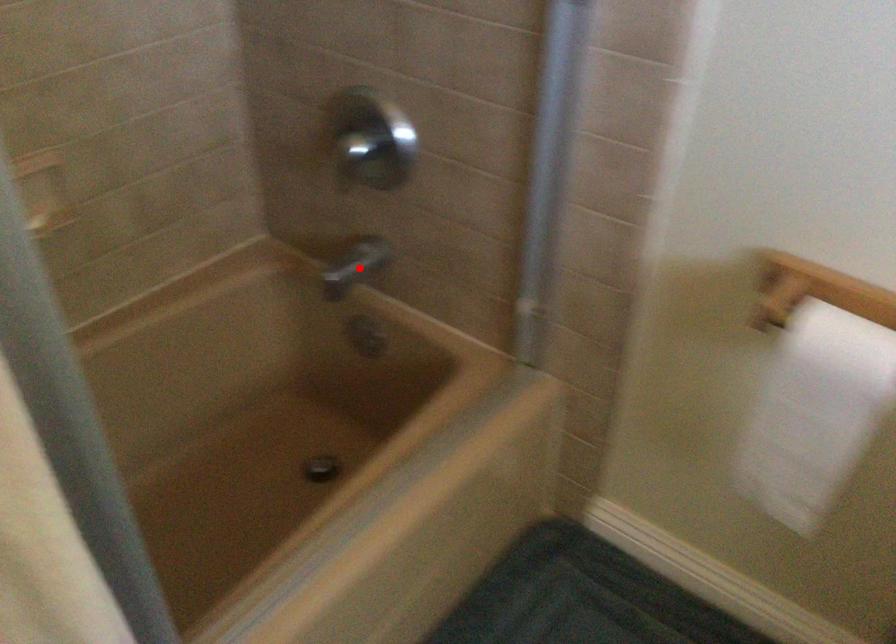
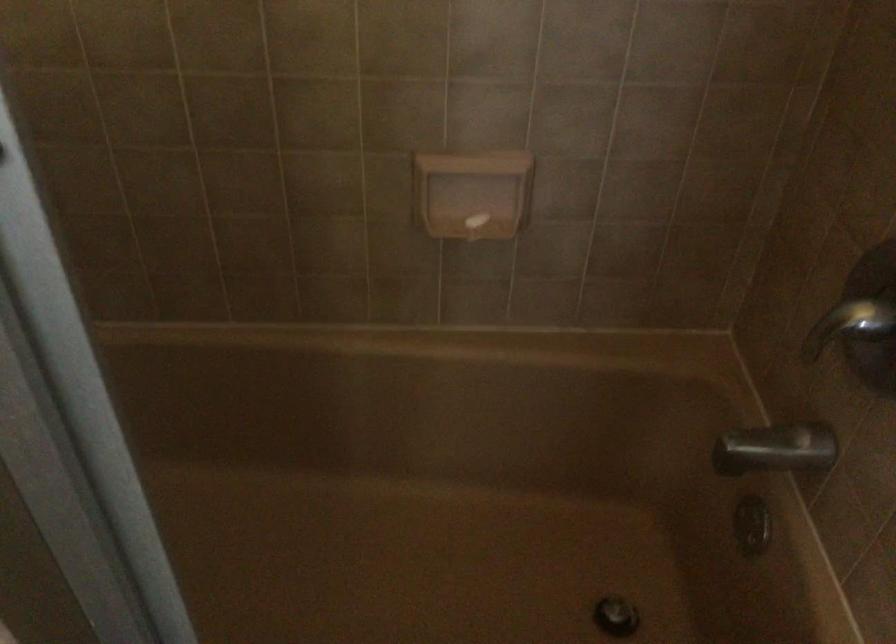
Find the pixel in the second image that matches the highlighted location in the first image.

(776, 449)